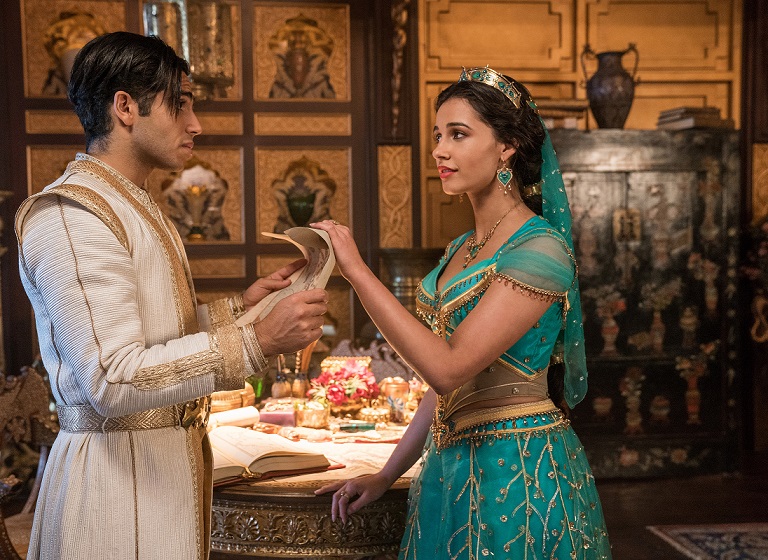
You are a GUI agent. You are given a task and a screenshot of the screen. Output one action in this format:
    pyautogui.click(x=<x>, y=<y>)
    Task: Click on the gold table
    The height and width of the screenshot is (560, 768).
    Given the screenshot: What is the action you would take?
    pyautogui.click(x=259, y=516)